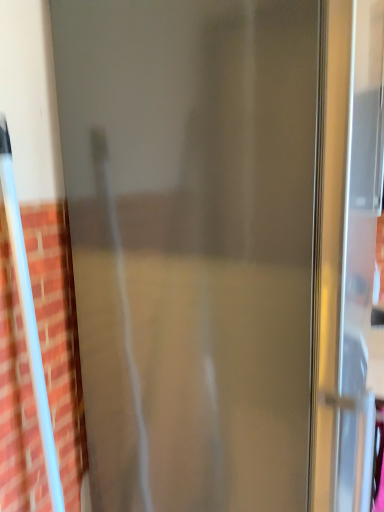
What do you see at coordinates (191, 245) in the screenshot? The width and height of the screenshot is (384, 512). I see `transparent glass door at center` at bounding box center [191, 245].

Where is `transparent glass door at center`? This screenshot has width=384, height=512. transparent glass door at center is located at coordinates (191, 245).

In order to face transparent glass door at center, should I rotate leftwards or rightwards?

It's best to rotate right around 6.875 degrees.

Identify the location of transparent glass door at center. (191, 245).